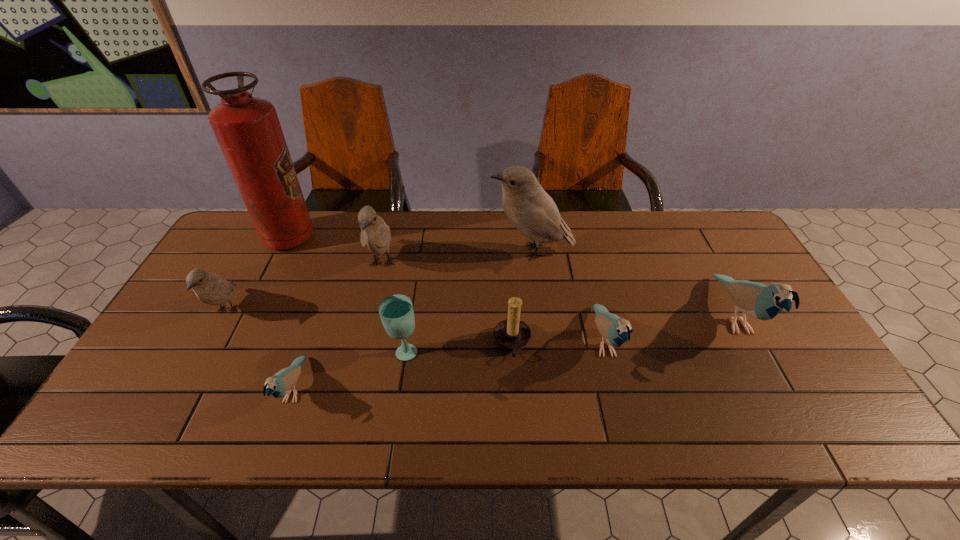
Locate an element on the screen. This screenshot has height=540, width=960. bird that can be found as the third closest to the second white bird from right to left is located at coordinates (210, 288).

The height and width of the screenshot is (540, 960). I want to click on the fourth closest bird to the second blue bird from left to right, so click(280, 384).

Locate which white bird is the closest to the brown candle holder. Please provide its 2D coordinates. Your answer should be formatted as a tuple, i.e. [(x, y)], where the tuple contains the x and y coordinates of a point satisfying the conditions above.

[(532, 211)]

Locate which white bird is the closest to the rightmost bird. Please provide its 2D coordinates. Your answer should be formatted as a tuple, i.e. [(x, y)], where the tuple contains the x and y coordinates of a point satisfying the conditions above.

[(532, 211)]

Locate which blue bird ranks second in proximity to the second blue bird from left to right. Please provide its 2D coordinates. Your answer should be formatted as a tuple, i.e. [(x, y)], where the tuple contains the x and y coordinates of a point satisfying the conditions above.

[(280, 384)]

The image size is (960, 540). Identify the location of the second closest blue bird relative to the biggest blue bird. (280, 384).

Locate an element on the screen. This screenshot has height=540, width=960. blank space that satisfies the following two spatial constraints: 1. on the label side of the tallest object; 2. on the back side of the glass is located at coordinates (233, 350).